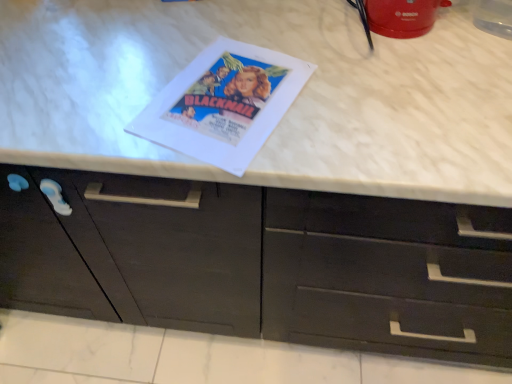
You are a GUI agent. You are given a task and a screenshot of the screen. Output one action in this format:
    pyautogui.click(x=<x>, y=<y>)
    Task: Click on the matte black cabinet at center
    The width and height of the screenshot is (512, 384).
    Given the screenshot: What is the action you would take?
    pyautogui.click(x=262, y=263)

What do you see at coordinates (262, 263) in the screenshot?
I see `matte black cabinet at center` at bounding box center [262, 263].

You are a GUI agent. You are given a task and a screenshot of the screen. Output one action in this format:
    pyautogui.click(x=<x>, y=<y>)
    Task: Click on the matte black cabinet at center
    
    Given the screenshot: What is the action you would take?
    pyautogui.click(x=262, y=263)